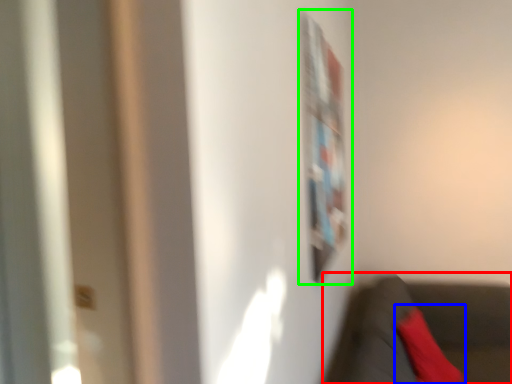
Question: Estimate the real-world distances between objects in this image. Which object is closer to chair (highlighted by a red box), pillow (highlighted by a blue box) or bulletin board (highlighted by a green box)?

Choices:
 (A) pillow
 (B) bulletin board

Answer: (A)